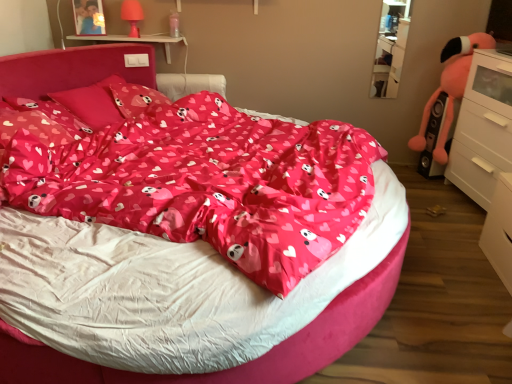
Describe the element at coordinates (40, 122) in the screenshot. Image resolution: width=512 pixels, height=384 pixels. I see `matte pink pillow at upper left, the third pillow when ordered from back to front` at that location.

What is the approximate height of matte pink plastic table lamp at upper left?

The height of matte pink plastic table lamp at upper left is 10.17 inches.

The image size is (512, 384). What do you see at coordinates (92, 103) in the screenshot?
I see `matte pink pillow at center, the second pillow from the front` at bounding box center [92, 103].

What do you see at coordinates (135, 41) in the screenshot?
I see `white plastic table at upper center` at bounding box center [135, 41].

This screenshot has width=512, height=384. Find the location of `white glossy chest of drawers at right`. white glossy chest of drawers at right is located at coordinates (487, 153).

This screenshot has height=384, width=512. Find the location of `matte pink bed at center`. matte pink bed at center is located at coordinates (243, 364).

Which object is more forward, matte pink plastic table lamp at upper left or matte pink pillow at center, arranged as the 2th pillow when viewed from the back?

matte pink pillow at center, arranged as the 2th pillow when viewed from the back, is more forward.

Is matte pink plastic table lamp at upper left outside of matte pink pillow at center, arranged as the 2th pillow when viewed from the back?

Indeed, matte pink plastic table lamp at upper left is completely outside matte pink pillow at center, arranged as the 2th pillow when viewed from the back.

Is point (137, 37) closer to camera compared to point (97, 108)?

No.

How much distance is there between matte pink plastic table lamp at upper left and matte pink pillow at center, arranged as the 2th pillow when viewed from the back?

A distance of 28.44 inches exists between matte pink plastic table lamp at upper left and matte pink pillow at center, arranged as the 2th pillow when viewed from the back.

Is white glossy chest of drawers at right bigger than white plastic table at upper center?

Indeed, white glossy chest of drawers at right has a larger size compared to white plastic table at upper center.

From the picture: Considering the relative sizes of white glossy chest of drawers at right and white plastic table at upper center in the image provided, is white glossy chest of drawers at right thinner than white plastic table at upper center?

In fact, white glossy chest of drawers at right might be wider than white plastic table at upper center.

Does white glossy chest of drawers at right have a lesser height compared to white plastic table at upper center?

Incorrect, the height of white glossy chest of drawers at right does not fall short of that of white plastic table at upper center.

Can you tell me how much white glossy chest of drawers at right and white plastic table at upper center differ in facing direction?

They differ by 78.8 degrees in their facing directions.

How many degrees apart are the facing directions of white plastic table at upper center and clear glass shelf at upper right?

The facing directions of white plastic table at upper center and clear glass shelf at upper right are 0.258 degrees apart.

Which object is more forward, white plastic table at upper center or clear glass shelf at upper right?

clear glass shelf at upper right is closer to the camera.

From a real-world perspective, is white plastic table at upper center on top of clear glass shelf at upper right?

Actually, white plastic table at upper center is physically below clear glass shelf at upper right in the real world.

Considering the relative positions of white plastic table at upper center and clear glass shelf at upper right in the image provided, is white plastic table at upper center to the left of clear glass shelf at upper right from the viewer's perspective?

Indeed, white plastic table at upper center is positioned on the left side of clear glass shelf at upper right.

Which object is wider, matte pink pillow at center, the 3th pillow in the front-to-back sequence, or matte pink pillow at center, arranged as the 2th pillow when viewed from the back?

matte pink pillow at center, arranged as the 2th pillow when viewed from the back, is wider.

Is point (138, 90) farther from camera compared to point (104, 113)?

Yes, it is.

Between matte pink pillow at center, the 3th pillow in the front-to-back sequence, and matte pink pillow at center, arranged as the 2th pillow when viewed from the back, which one has larger size?

matte pink pillow at center, arranged as the 2th pillow when viewed from the back, is bigger.

Considering the sizes of objects matte pink pillow at center, which is counted as the first pillow, starting from the back, and matte pink pillow at center, the second pillow from the front, in the image provided, who is shorter, matte pink pillow at center, which is counted as the first pillow, starting from the back, or matte pink pillow at center, the second pillow from the front,?

Standing shorter between the two is matte pink pillow at center, which is counted as the first pillow, starting from the back.

Is white plastic table at upper center next to fluffy pink stuffed animal at right and touching it?

No, white plastic table at upper center is not making contact with fluffy pink stuffed animal at right.

Can you confirm if white plastic table at upper center is taller than fluffy pink stuffed animal at right?

No, white plastic table at upper center is not taller than fluffy pink stuffed animal at right.

Locate an element on the screen. toy that is under the white plastic table at upper center (from a real-world perspective) is located at coordinates (450, 88).

Is white plastic table at upper center inside or outside of fluffy pink stuffed animal at right?

white plastic table at upper center is not inside fluffy pink stuffed animal at right, it's outside.

Can you confirm if matte pink bed at center is positioned to the right of fluffy pink stuffed animal at right?

No.

Is matte pink bed at center bigger or smaller than fluffy pink stuffed animal at right?

In the image, matte pink bed at center appears to be larger than fluffy pink stuffed animal at right.

Who is shorter, matte pink bed at center or fluffy pink stuffed animal at right?

Standing shorter between the two is matte pink bed at center.

Are matte pink bed at center and fluffy pink stuffed animal at right making contact?

No.

From a real-world perspective, is matte pink plastic table lamp at upper left under matte pink bed at center?

No, from a real-world perspective, matte pink plastic table lamp at upper left is not under matte pink bed at center.

Which is behind, matte pink plastic table lamp at upper left or matte pink bed at center?

matte pink plastic table lamp at upper left is more distant.

Is matte pink plastic table lamp at upper left next to matte pink bed at center?

No, matte pink plastic table lamp at upper left is not next to matte pink bed at center.

Which object is wider, matte pink plastic table lamp at upper left or matte pink bed at center?

With larger width is matte pink bed at center.

Starting from the matte pink plastic table lamp at upper left, which pillow is the 1st one to the left? Please provide its 2D coordinates.

[(92, 103)]

In the image, there is a white plastic table at upper center. Where is `the chest of drawers below it (from the image's perspective)`? Image resolution: width=512 pixels, height=384 pixels. the chest of drawers below it (from the image's perspective) is located at coordinates (487, 153).

When comparing their distances from matte pink pillow at center, the 3th pillow in the front-to-back sequence, does fluffy pink stuffed animal at right or matte pink pillow at upper left, arranged as the 1th pillow when viewed from the front, seem further?

fluffy pink stuffed animal at right is positioned further to the anchor matte pink pillow at center, the 3th pillow in the front-to-back sequence.

From the image, which object appears to be nearer to matte pink pillow at center, the second pillow from the front, clear glass shelf at upper right or matte pink plastic table lamp at upper left?

matte pink plastic table lamp at upper left lies closer to matte pink pillow at center, the second pillow from the front, than the other object.

From the image, which object appears to be nearer to matte pink plastic table lamp at upper left, white glossy chest of drawers at right or fluffy pink stuffed animal at right?

fluffy pink stuffed animal at right lies closer to matte pink plastic table lamp at upper left than the other object.

Based on the photo, when comparing their distances from matte pink pillow at center, which is counted as the first pillow, starting from the back, does matte pink plastic table lamp at upper left or fluffy pink stuffed animal at right seem further?

Based on the image, fluffy pink stuffed animal at right appears to be further to matte pink pillow at center, which is counted as the first pillow, starting from the back.

Considering their positions, is fluffy pink stuffed animal at right positioned closer to matte pink pillow at upper left, arranged as the 1th pillow when viewed from the front, than matte pink plastic table lamp at upper left?

matte pink plastic table lamp at upper left is closer to matte pink pillow at upper left, arranged as the 1th pillow when viewed from the front.

Which object lies further to the anchor point matte pink bed at center, matte pink pillow at center, which is counted as the first pillow, starting from the back, or matte pink pillow at center, arranged as the 2th pillow when viewed from the back?

matte pink pillow at center, arranged as the 2th pillow when viewed from the back, lies further to matte pink bed at center than the other object.

When comparing their distances from white plastic table at upper center, does clear glass shelf at upper right or matte pink pillow at upper left, arranged as the 1th pillow when viewed from the front, seem further?

Based on the image, clear glass shelf at upper right appears to be further to white plastic table at upper center.

Looking at the image, which one is located closer to matte pink pillow at center, which is counted as the first pillow, starting from the back, clear glass shelf at upper right or matte pink pillow at center, the second pillow from the front?

Among the two, matte pink pillow at center, the second pillow from the front, is located nearer to matte pink pillow at center, which is counted as the first pillow, starting from the back.

Identify the location of shelf between white plastic table at upper center and white glossy chest of drawers at right in the horizontal direction. This screenshot has width=512, height=384. point(390,48).

Locate an element on the screen. bed between matte pink pillow at center, the 3th pillow in the front-to-back sequence, and fluffy pink stuffed animal at right, in the horizontal direction is located at coordinates (243, 364).

At what (x,y) coordinates should I click in order to perform the action: click on table lamp between matte pink bed at center and white plastic table at upper center in the front-back direction. Please return your answer as a coordinate pair (x, y). This screenshot has width=512, height=384. Looking at the image, I should click on (132, 15).

Identify the location of table lamp between matte pink pillow at upper left, the third pillow when ordered from back to front, and clear glass shelf at upper right from left to right. This screenshot has width=512, height=384. (132, 15).